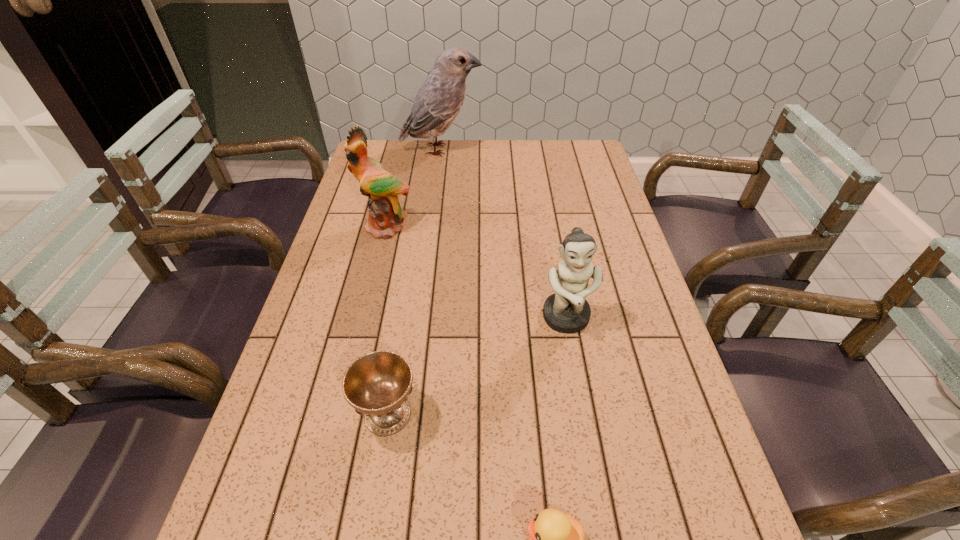
Where is `vacant area that lies between the chalice and the fourth nearest object`? vacant area that lies between the chalice and the fourth nearest object is located at coordinates (387, 321).

You are a GUI agent. You are given a task and a screenshot of the screen. Output one action in this format:
    pyautogui.click(x=<x>, y=<y>)
    Task: Click on the object that is the third nearest to the second shortest object
    Image resolution: width=960 pixels, height=540 pixels.
    Given the screenshot: What is the action you would take?
    pyautogui.click(x=385, y=213)

Choose which object is the fourth nearest neighbor to the farthest object. Please provide its 2D coordinates. Your answer should be formatted as a tuple, i.e. [(x, y)], where the tuple contains the x and y coordinates of a point satisfying the conditions above.

[(556, 539)]

Where is `free space that satisfies the following two spatial constraints: 1. on the front-facing side of the farthest object; 2. on the front-facing side of the second farthest object`? free space that satisfies the following two spatial constraints: 1. on the front-facing side of the farthest object; 2. on the front-facing side of the second farthest object is located at coordinates (431, 227).

I want to click on free spot that satisfies the following two spatial constraints: 1. on the front-facing side of the farther parrot; 2. on the front-facing side of the nearer parrot, so click(431, 227).